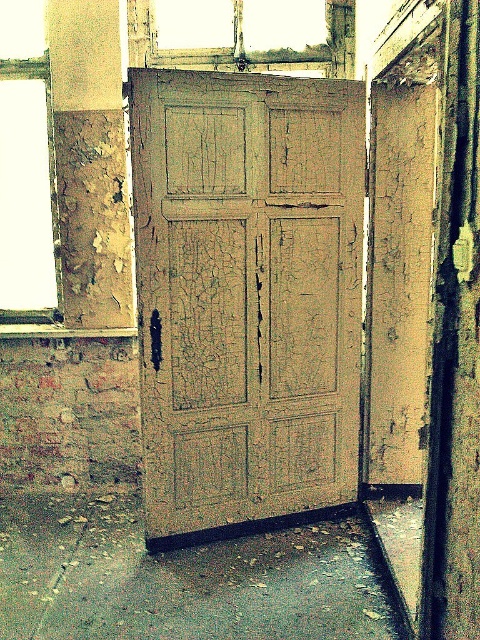
You are a painter who needs to transport a large canvas that is 1.5 meters wide. You have to choose between the cracked wood door at center and the transparent glass window at upper left to pass through. Which one should you choose?

The cracked wood door at center has a larger width than the transparent glass window at upper left, so you should choose the cracked wood door at center to pass through with your large canvas.

You are a contractor assessing the structural integrity of an old building. You notice a transparent glass window at upper left and a wooden frame at upper center. Which object is located below the other?

The transparent glass window at upper left is positioned under the wooden frame at upper center, meaning the window is below the wooden frame.

You are a painter trying to assess the condition of the building. You notice the cracked wood door at center and the transparent glass window at upper left. Which object is closer to you, the painter, as you stand in front of the building?

The cracked wood door at center is closer to you because it is in front of the transparent glass window at upper left.